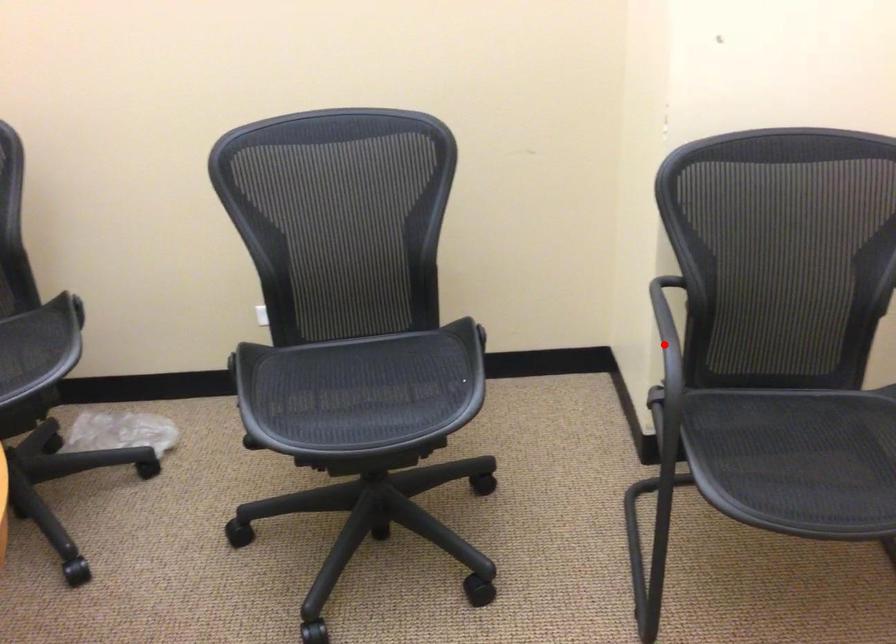
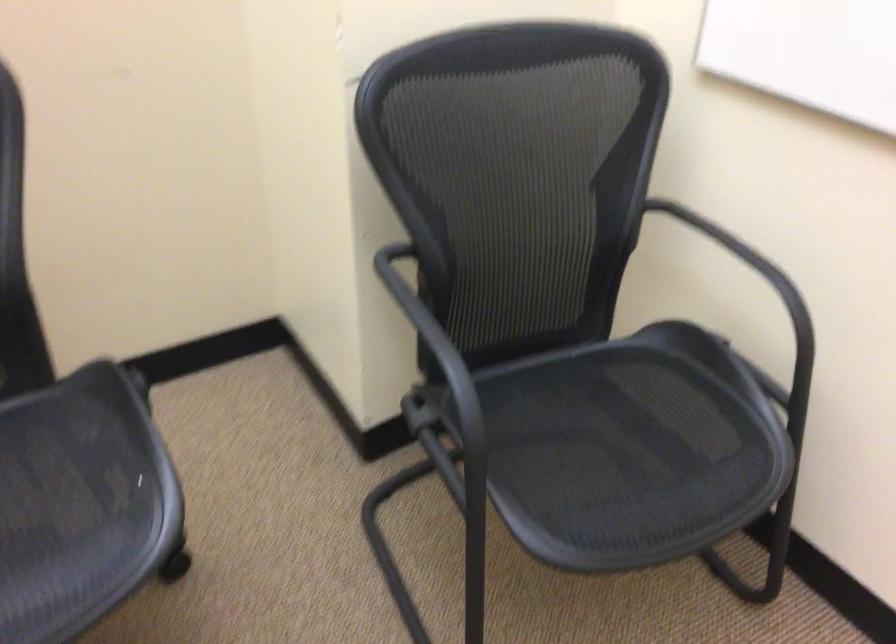
Question: A red point is marked in image1. In image2, is the corresponding 3D point closer to the camera or farther? Reply with the corresponding letter.

Choices:
 (A) The corresponding 3D point is closer.
 (B) The corresponding 3D point is farther.

Answer: (A)